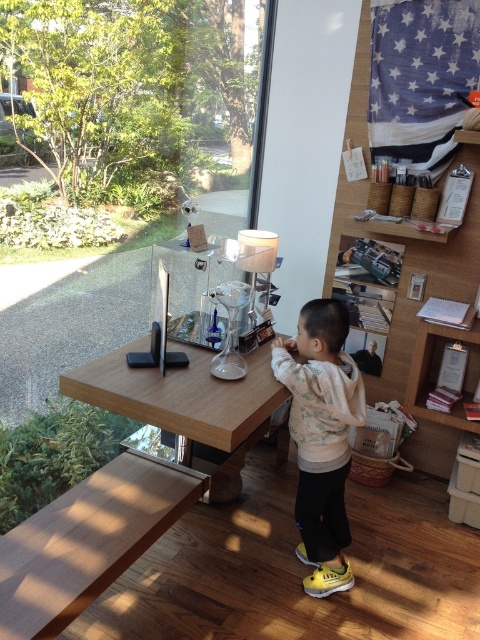
You are a child trying to reach for a toy that is placed on the brown wood table at lower left and the wooden table at center. Which table is easier to reach without moving your current position?

The brown wood table at lower left is closer to you, so it is easier to reach without moving.

From the picture: You are a parent trying to decide whether to put the light pink fleece sweater at center on the wooden table at center. Based on their sizes, will the sweater fit on the table without hanging over the edges?

The light pink fleece sweater at center is taller than wooden table at center, so it will not fit on the table without hanging over the edges.